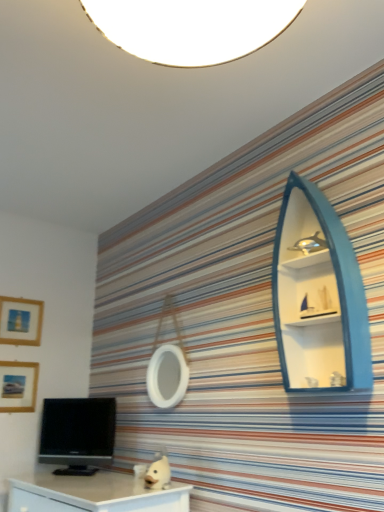
Question: Is teal wood boat-shaped shelf at upper right smaller than black glossy tv at lower left?

Choices:
 (A) yes
 (B) no

Answer: (B)

Question: Could black glossy tv at lower left be considered to be inside teal wood boat-shaped shelf at upper right?

Choices:
 (A) yes
 (B) no

Answer: (B)

Question: Is teal wood boat-shaped shelf at upper right taller than black glossy tv at lower left?

Choices:
 (A) no
 (B) yes

Answer: (B)

Question: Is teal wood boat-shaped shelf at upper right oriented away from black glossy tv at lower left?

Choices:
 (A) no
 (B) yes

Answer: (A)

Question: From a real-world perspective, is teal wood boat-shaped shelf at upper right physically below black glossy tv at lower left?

Choices:
 (A) no
 (B) yes

Answer: (A)

Question: Is black glossy tv at lower left bigger or smaller than teal wood boat-shaped shelf at upper right?

Choices:
 (A) small
 (B) big

Answer: (A)

Question: From a real-world perspective, is black glossy tv at lower left positioned above or below teal wood boat-shaped shelf at upper right?

Choices:
 (A) below
 (B) above

Answer: (A)

Question: Is black glossy tv at lower left in front of or behind teal wood boat-shaped shelf at upper right in the image?

Choices:
 (A) behind
 (B) front

Answer: (A)

Question: Is point (44, 434) closer or farther from the camera than point (329, 388)?

Choices:
 (A) closer
 (B) farther

Answer: (B)

Question: In terms of width, does matte gold picture frame at upper left, the second picture frame from the bottom, look wider or thinner when compared to teal wood boat-shaped shelf at upper right?

Choices:
 (A) wide
 (B) thin

Answer: (B)

Question: In the image, is matte gold picture frame at upper left, the second picture frame from the bottom, positioned in front of or behind teal wood boat-shaped shelf at upper right?

Choices:
 (A) front
 (B) behind

Answer: (B)

Question: Is matte gold picture frame at upper left, the second picture frame from the bottom, spatially inside teal wood boat-shaped shelf at upper right, or outside of it?

Choices:
 (A) outside
 (B) inside

Answer: (A)

Question: In terms of height, does matte gold picture frame at upper left, the second picture frame from the bottom, look taller or shorter compared to teal wood boat-shaped shelf at upper right?

Choices:
 (A) short
 (B) tall

Answer: (A)

Question: Is matte gold picture frame at upper left, positioned as the 1th picture frame in top-to-bottom order, inside the boundaries of black glossy tv at lower left, or outside?

Choices:
 (A) inside
 (B) outside

Answer: (B)

Question: Is matte gold picture frame at upper left, positioned as the 1th picture frame in top-to-bottom order, in front of or behind black glossy tv at lower left in the image?

Choices:
 (A) behind
 (B) front

Answer: (A)